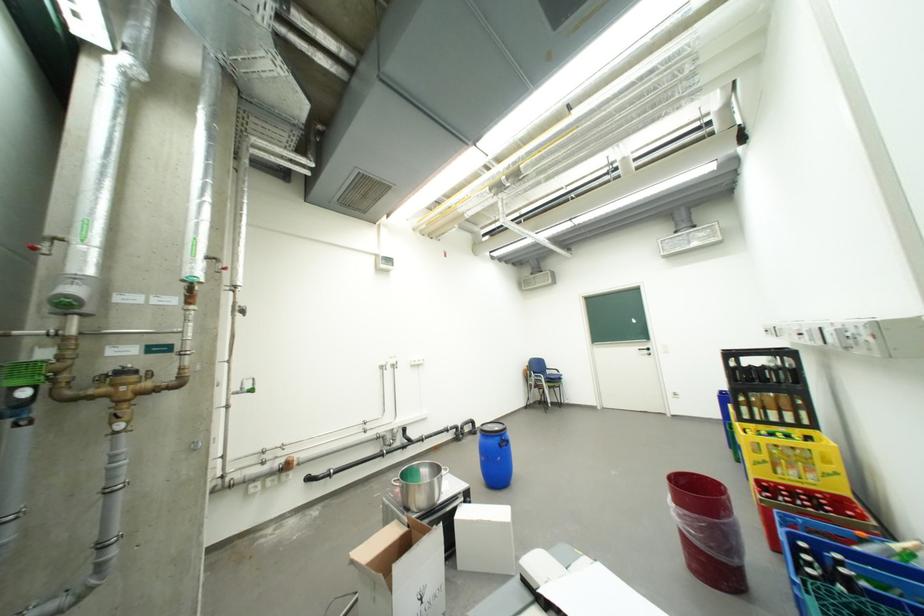
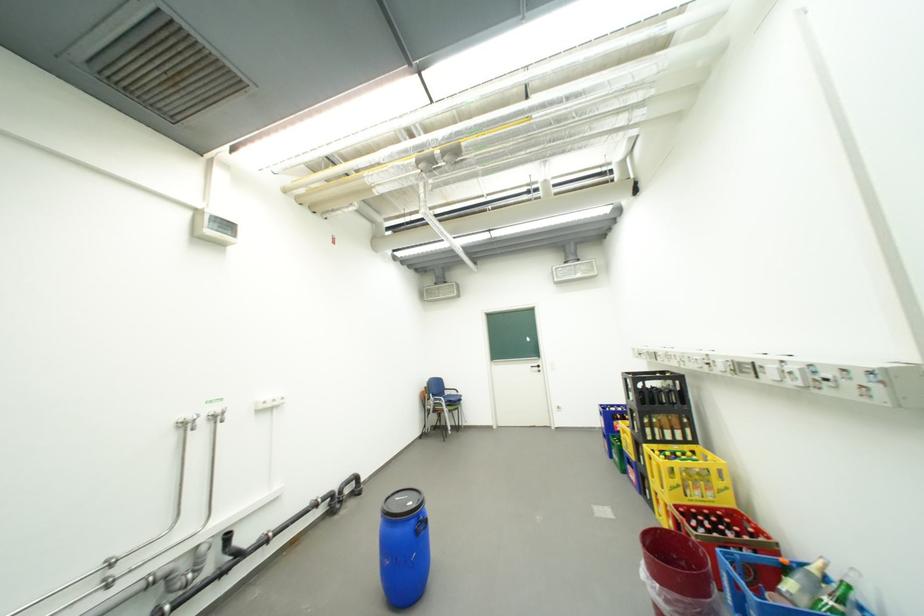
Question: What movement of the cameraman would produce the second image?

Choices:
 (A) Left
 (B) Right
 (C) Forward
 (D) Backward

Answer: (C)